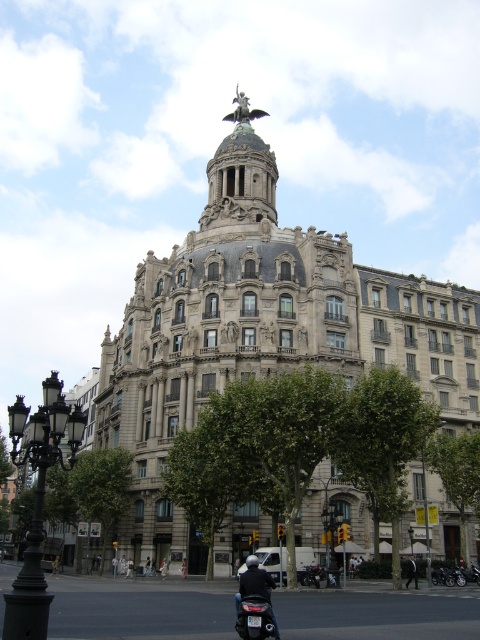
You are standing in front of the grand building and want to take a photo that includes both the green leafy tree at center and the green leafy tree at lower right. Which tree should you position closer to the camera to ensure both are in the frame?

You should position the green leafy tree at center closer to the camera because it is already closer to the viewer than the green leafy tree at lower right, so adjusting the camera angle to include both would require framing around their existing positions.

You are standing in front of the grand building and notice two points marked on its facade. The first point is at coordinates point (374, 476) and the second is at point (454, 493). Which of these two points is nearer to your current position?

Point (374, 476) is closer to the viewer than point (454, 493).

You are standing in front of the grand ornate building with the dome and statue. There is a green leafy tree at center. Can you see the tree from the front entrance of the building?

The green leafy tree at center is located at point (383, 444), which is likely in front of the building, so yes, you can see the tree from the front entrance of the building.